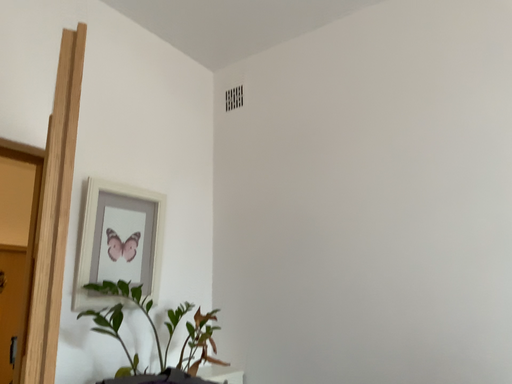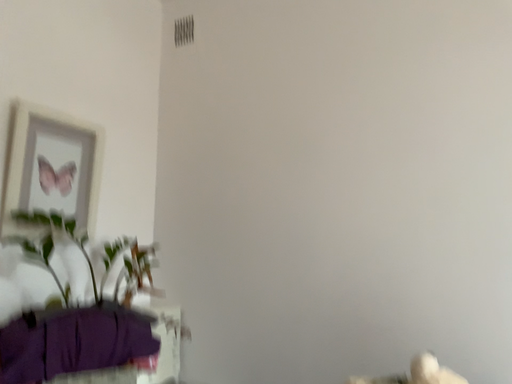
Question: How did the camera likely rotate when shooting the video?

Choices:
 (A) rotated downward
 (B) rotated upward

Answer: (A)